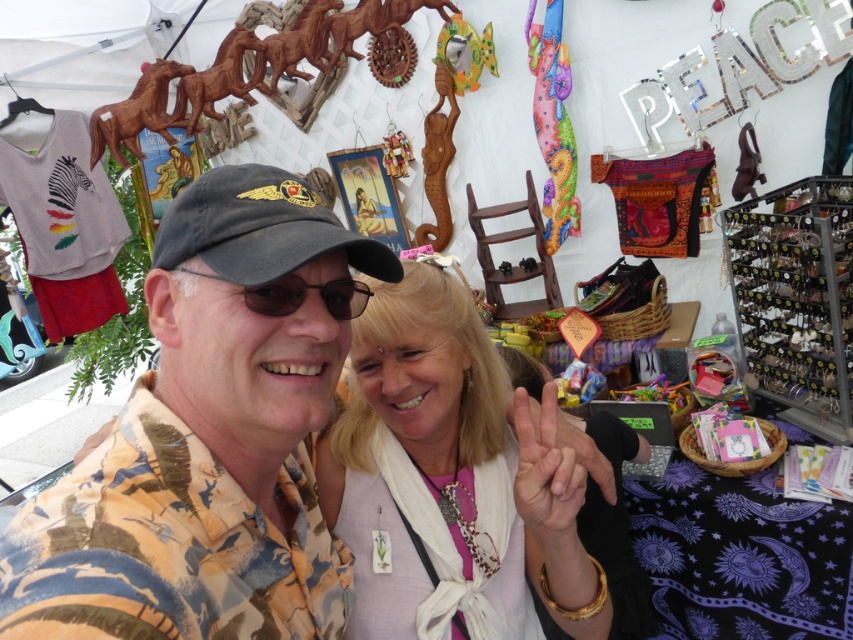
Who is more forward, (335, 218) or (357, 294)?

Point (335, 218) is more forward.

Does black fabric baseball cap at center have a larger size compared to black plastic goggles at center?

Indeed, black fabric baseball cap at center has a larger size compared to black plastic goggles at center.

Does point (154, 240) come farther from viewer compared to point (177, 268)?

That is True.

The height and width of the screenshot is (640, 853). Find the location of `black fabric baseball cap at center`. black fabric baseball cap at center is located at coordinates (260, 227).

Can you confirm if white fabric scarf at center is taller than black plastic goggles at center?

Yes, white fabric scarf at center is taller than black plastic goggles at center.

Which is below, white fabric scarf at center or black plastic goggles at center?

white fabric scarf at center is below.

What do you see at coordinates (447, 474) in the screenshot?
I see `white fabric scarf at center` at bounding box center [447, 474].

At what (x,y) coordinates should I click in order to perform the action: click on white fabric scarf at center. Please return your answer as a coordinate pair (x, y). Looking at the image, I should click on (447, 474).

Does white fabric scarf at center appear on the right side of black fabric baseball cap at center?

Correct, you'll find white fabric scarf at center to the right of black fabric baseball cap at center.

This screenshot has width=853, height=640. Find the location of `white fabric scarf at center`. white fabric scarf at center is located at coordinates (447, 474).

Who is more distant from viewer, (520,557) or (381,273)?

The point (520,557) is behind.

The width and height of the screenshot is (853, 640). In order to click on white fabric scarf at center in this screenshot , I will do `click(447, 474)`.